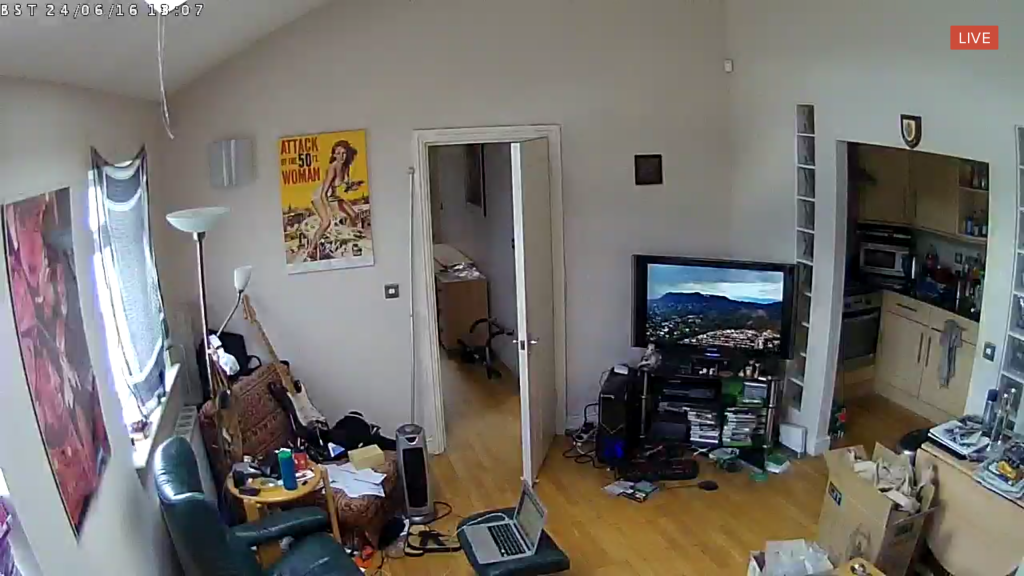
Find the location of a particular element. This screenshot has height=576, width=1024. open cardboard box with brown wrapping is located at coordinates (863, 501).